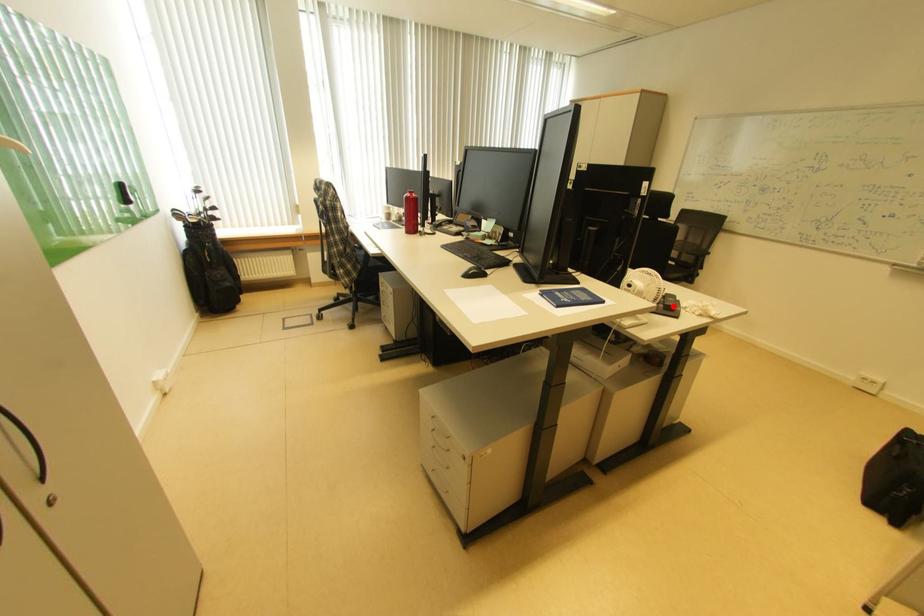
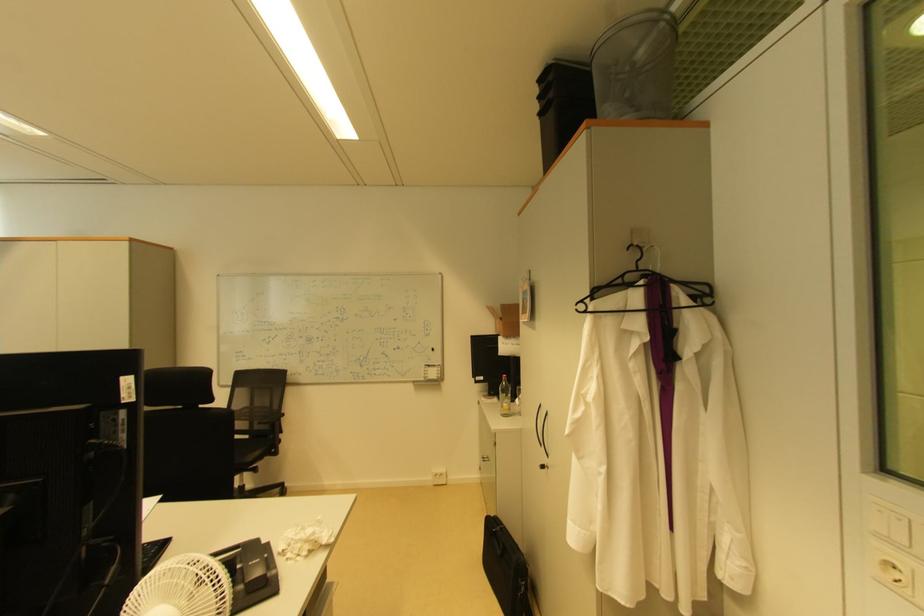
Question: I am providing you with two images of the same scene from different viewpoints. A red point is marked on the first image. At the location where the point appears in image 1, is it still visible in image 2?

Choices:
 (A) Yes
 (B) No

Answer: (A)